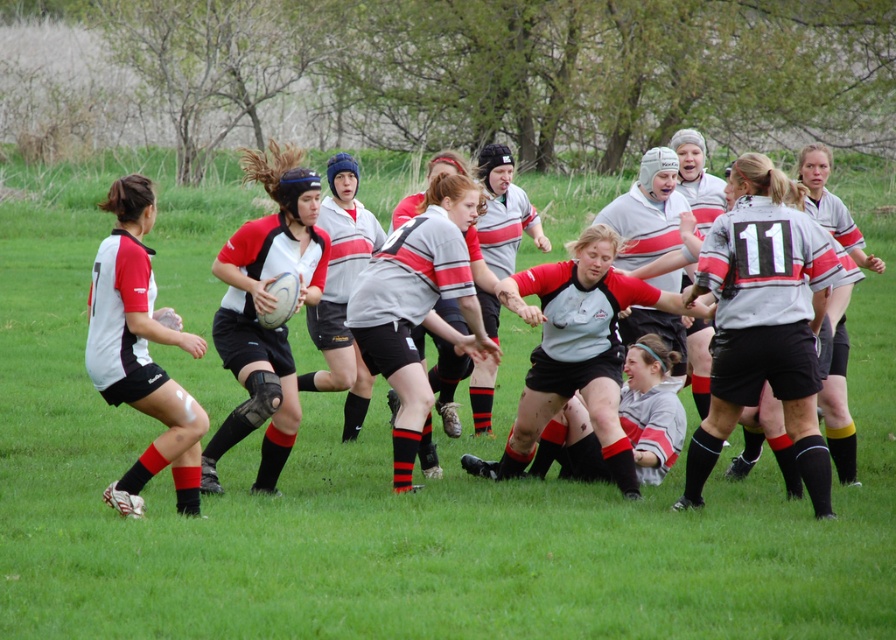
Does matte black rugby ball at center lie behind gray matte rugby jersey at center?

No, it is in front of gray matte rugby jersey at center.

Can you confirm if matte black rugby ball at center is positioned above gray matte rugby jersey at center?

Correct, matte black rugby ball at center is located above gray matte rugby jersey at center.

Where is `matte black rugby ball at center`? matte black rugby ball at center is located at coordinates (265, 308).

Who is lower down, matte black rugby ball at center or matte black shorts at left?

matte black shorts at left is below.

Is point (230, 308) in front of point (151, 224)?

No, it is behind (151, 224).

The image size is (896, 640). What are the coordinates of `matte black rugby ball at center` in the screenshot? It's located at (265, 308).

Between point (119, 490) and point (433, 272), which one is positioned behind?

The point (433, 272) is behind.

Who is higher up, matte black shorts at left or gray matte rugby jersey at center?

gray matte rugby jersey at center is above.

Measure the distance between point (104, 285) and camera.

Point (104, 285) and camera are 23.56 feet apart from each other.

Image resolution: width=896 pixels, height=640 pixels. I want to click on matte black shorts at left, so click(x=140, y=352).